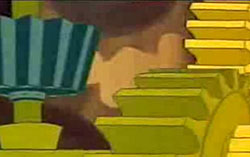
This screenshot has height=157, width=250. I want to click on blue bucket, so click(38, 39).